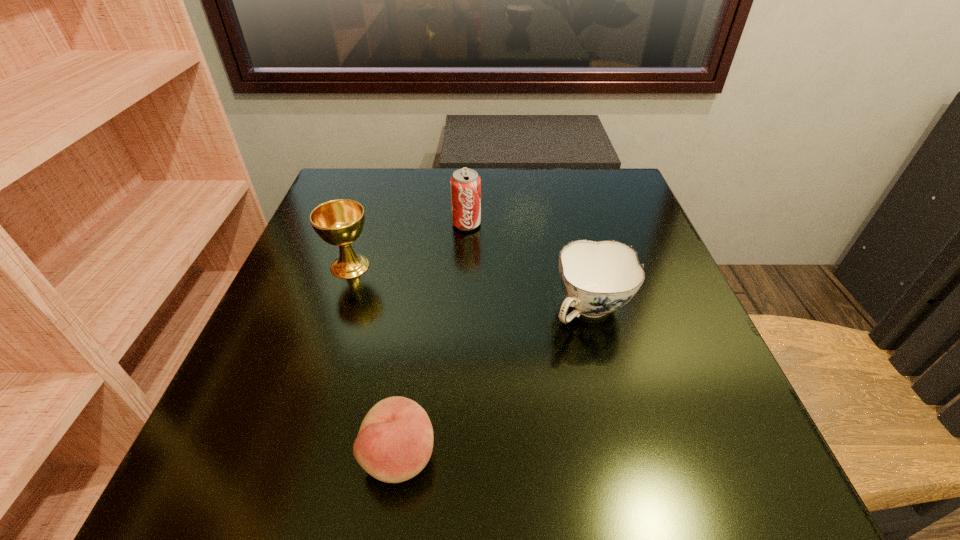
Select which object is the third closest to the peach. Please provide its 2D coordinates. Your answer should be formatted as a tuple, i.e. [(x, y)], where the tuple contains the x and y coordinates of a point satisfying the conditions above.

[(465, 184)]

Where is `vacant space that satisfies the following two spatial constraints: 1. on the back side of the rightmost object; 2. on the left side of the nearest object`? This screenshot has height=540, width=960. vacant space that satisfies the following two spatial constraints: 1. on the back side of the rightmost object; 2. on the left side of the nearest object is located at coordinates (420, 309).

You are a GUI agent. You are given a task and a screenshot of the screen. Output one action in this format:
    pyautogui.click(x=<x>, y=<y>)
    Task: Click on the vacant space that satisfies the following two spatial constraints: 1. on the back side of the farthest object; 2. on the left side of the leftmost object
    The width and height of the screenshot is (960, 540).
    Given the screenshot: What is the action you would take?
    pyautogui.click(x=364, y=224)

In order to click on free spot that satisfies the following two spatial constraints: 1. on the back side of the peach; 2. on the left side of the farthest object in this screenshot , I will do `click(432, 224)`.